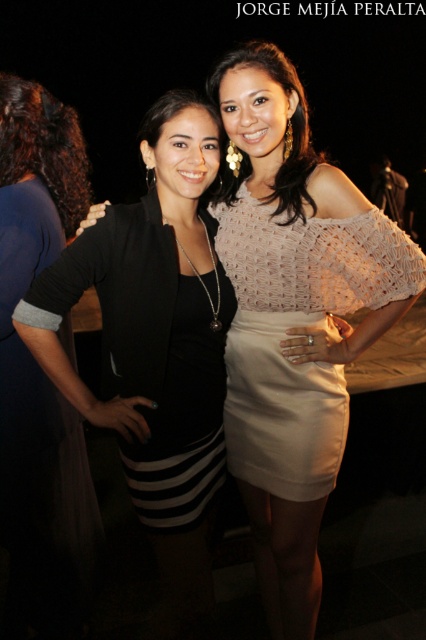
You are a photographer at a social event and want to ensure both the white crochet dress at center and the dark brown curly hair at left are clearly visible in your photo. Which object should you focus on first to ensure proper framing?

The white crochet dress at center is taller than the dark brown curly hair at left, so focusing on the white crochet dress at center first will ensure proper framing as it occupies more vertical space in the image.

In the scene shown: You are a photographer at a fashion show. You need to arrange two models wearing the black matte dress at left and white crochet dress at center so that their heights are proportional to their actual dress sizes. Which dress should be placed higher in the photo?

The black matte dress at left should be placed higher in the photo because it is taller than the white crochet dress at center, ensuring the arrangement reflects their actual sizes proportionally.